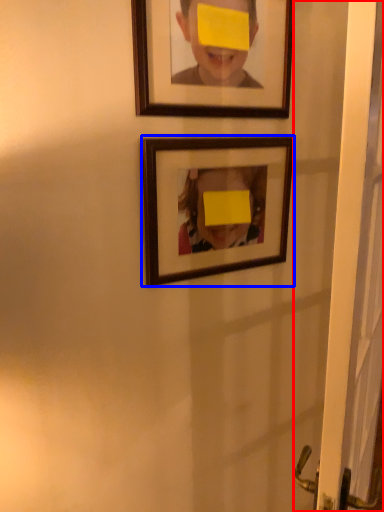
Question: Which object appears farthest to the camera in this image, screen door (highlighted by a red box) or picture frame (highlighted by a blue box)?

Choices:
 (A) screen door
 (B) picture frame

Answer: (B)